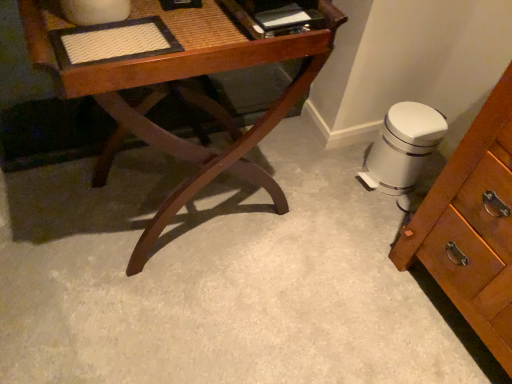
Question: Can you confirm if white glossy trash can at lower right is shorter than glossy wood desk at center?

Choices:
 (A) no
 (B) yes

Answer: (B)

Question: From a real-world perspective, is white glossy trash can at lower right on glossy wood desk at center?

Choices:
 (A) yes
 (B) no

Answer: (B)

Question: Can glossy wood desk at center be found inside white glossy trash can at lower right?

Choices:
 (A) yes
 (B) no

Answer: (B)

Question: Does white glossy trash can at lower right come in front of glossy wood desk at center?

Choices:
 (A) no
 (B) yes

Answer: (A)

Question: Is white glossy trash can at lower right aimed at glossy wood desk at center?

Choices:
 (A) no
 (B) yes

Answer: (B)

Question: Considering the relative sizes of white glossy trash can at lower right and glossy wood desk at center in the image provided, is white glossy trash can at lower right taller than glossy wood desk at center?

Choices:
 (A) no
 (B) yes

Answer: (A)

Question: Is glossy wood desk at center touching white glossy trash can at lower right?

Choices:
 (A) no
 (B) yes

Answer: (A)

Question: Is glossy wood desk at center oriented away from white glossy trash can at lower right?

Choices:
 (A) no
 (B) yes

Answer: (A)

Question: From a real-world perspective, is glossy wood desk at center below white glossy trash can at lower right?

Choices:
 (A) no
 (B) yes

Answer: (A)

Question: Does glossy wood desk at center appear on the left side of white glossy trash can at lower right?

Choices:
 (A) no
 (B) yes

Answer: (B)

Question: Is glossy wood desk at center shorter than white glossy trash can at lower right?

Choices:
 (A) yes
 (B) no

Answer: (B)

Question: From a real-world perspective, is glossy wood desk at center positioned over white glossy trash can at lower right based on gravity?

Choices:
 (A) no
 (B) yes

Answer: (B)

Question: Is point (426, 155) positioned closer to the camera than point (193, 18)?

Choices:
 (A) farther
 (B) closer

Answer: (A)